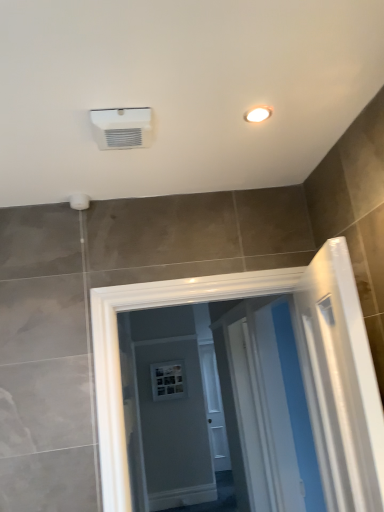
This screenshot has width=384, height=512. Describe the element at coordinates (267, 408) in the screenshot. I see `white glossy screen door at center` at that location.

Locate an element on the screen. This screenshot has height=512, width=384. white plastic air conditioning unit at upper center is located at coordinates (121, 127).

Image resolution: width=384 pixels, height=512 pixels. I want to click on screen door on the right side of white plastic air conditioning unit at upper center, so click(267, 408).

Between white plastic air conditioning unit at upper center and white glossy screen door at center, which one has larger size?

With larger size is white glossy screen door at center.

How different are the orientations of white plastic air conditioning unit at upper center and white glossy screen door at center in degrees?

There is a 90.1-degree angle between the facing directions of white plastic air conditioning unit at upper center and white glossy screen door at center.

From the image's perspective, who appears lower, white glossy screen door at center or white plastic air conditioning unit at upper center?

white glossy screen door at center appears lower in the image.

How many degrees apart are the facing directions of white glossy screen door at center and white plastic air conditioning unit at upper center?

white glossy screen door at center and white plastic air conditioning unit at upper center are facing 90.1 degrees away from each other.

Does point (266, 442) lie in front of point (112, 111)?

That is False.

Is white glossy light fixture at upper right wider or thinner than white plastic air conditioning unit at upper center?

Considering their sizes, white glossy light fixture at upper right looks slimmer than white plastic air conditioning unit at upper center.

Considering the positions of points (263, 110) and (114, 123), is point (263, 110) closer to camera compared to point (114, 123)?

No, it is behind (114, 123).

Does white glossy light fixture at upper right turn towards white plastic air conditioning unit at upper center?

No, white glossy light fixture at upper right is not oriented towards white plastic air conditioning unit at upper center.

From a real-world perspective, between white glossy light fixture at upper right and white plastic air conditioning unit at upper center, who is vertically lower?

In real-world perspective, white plastic air conditioning unit at upper center is lower.

Between white glossy light fixture at upper right and white glossy screen door at center, which one has larger size?

With larger size is white glossy screen door at center.

From the image's perspective, relative to white glossy screen door at center, is white glossy light fixture at upper right above or below?

white glossy light fixture at upper right is situated higher than white glossy screen door at center in the image.

Could white glossy screen door at center be considered to be inside white glossy light fixture at upper right?

Definitely not — white glossy screen door at center is not inside white glossy light fixture at upper right.

Considering the relative positions of white plastic air conditioning unit at upper center and white glossy light fixture at upper right in the image provided, is white plastic air conditioning unit at upper center in front of white glossy light fixture at upper right?

Yes, white plastic air conditioning unit at upper center is in front of white glossy light fixture at upper right.

Can you confirm if white plastic air conditioning unit at upper center is positioned to the left of white glossy light fixture at upper right?

Indeed, white plastic air conditioning unit at upper center is positioned on the left side of white glossy light fixture at upper right.

Is white plastic air conditioning unit at upper center taller than white glossy light fixture at upper right?

Correct, white plastic air conditioning unit at upper center is much taller as white glossy light fixture at upper right.

What's the angular difference between white plastic air conditioning unit at upper center and white glossy light fixture at upper right's facing directions?

1.4 degrees.

Looking at this image, is white glossy screen door at center positioned in front of white glossy light fixture at upper right?

No, white glossy screen door at center is further to the viewer.

Can you confirm if white glossy screen door at center is positioned to the right of white glossy light fixture at upper right?

Indeed, white glossy screen door at center is positioned on the right side of white glossy light fixture at upper right.

Would you say white glossy screen door at center contains white glossy light fixture at upper right?

No, white glossy screen door at center does not contain white glossy light fixture at upper right.

What are the coordinates of `screen door below the white plastic air conditioning unit at upper center (from a real-world perspective)` in the screenshot? It's located at [x=267, y=408].

The height and width of the screenshot is (512, 384). What are the coordinates of `screen door on the right of white plastic air conditioning unit at upper center` in the screenshot? It's located at (267, 408).

Based on their spatial positions, is white plastic air conditioning unit at upper center or white glossy light fixture at upper right further from white glossy screen door at center?

white glossy light fixture at upper right is further to white glossy screen door at center.

From the picture: Which object lies further to the anchor point white glossy screen door at center, white glossy light fixture at upper right or white plastic air conditioning unit at upper center?

white glossy light fixture at upper right is positioned further to the anchor white glossy screen door at center.

Estimate the real-world distances between objects in this image. Which object is closer to white glossy light fixture at upper right, white plastic air conditioning unit at upper center or white glossy screen door at center?

white plastic air conditioning unit at upper center is closer to white glossy light fixture at upper right.

Based on their spatial positions, is white glossy screen door at center or white glossy light fixture at upper right further from white plastic air conditioning unit at upper center?

Based on the image, white glossy screen door at center appears to be further to white plastic air conditioning unit at upper center.

When comparing their distances from white glossy light fixture at upper right, does white glossy screen door at center or white plastic air conditioning unit at upper center seem closer?

white plastic air conditioning unit at upper center lies closer to white glossy light fixture at upper right than the other object.

When comparing their distances from white plastic air conditioning unit at upper center, does white glossy light fixture at upper right or white glossy screen door at center seem further?

white glossy screen door at center is positioned further to the anchor white plastic air conditioning unit at upper center.

I want to click on air conditioning between white glossy light fixture at upper right and white glossy screen door at center in the vertical direction, so click(121, 127).